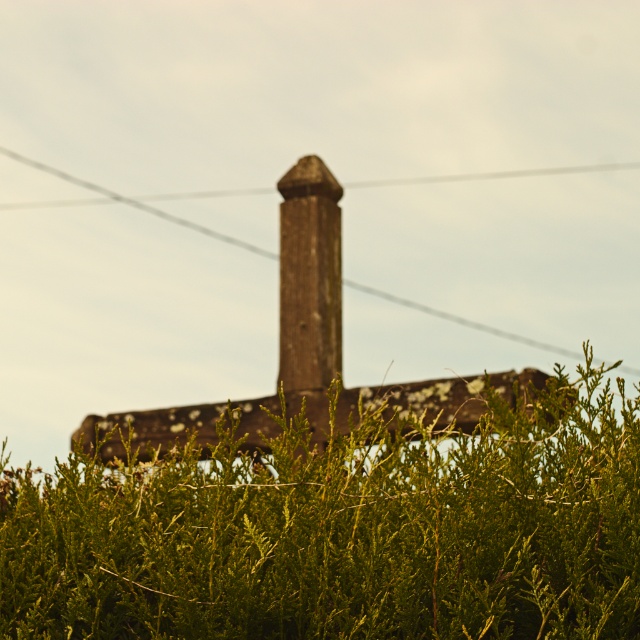
Question: Which object is closer to the camera taking this photo?

Choices:
 (A) green leafy hedge at center
 (B) brown stone pillar at center

Answer: (A)

Question: Is green leafy hedge at center thinner than brown stone pillar at center?

Choices:
 (A) no
 (B) yes

Answer: (A)

Question: Does green leafy hedge at center lie behind brown stone pillar at center?

Choices:
 (A) no
 (B) yes

Answer: (A)

Question: Is green leafy hedge at center wider than brown stone pillar at center?

Choices:
 (A) yes
 (B) no

Answer: (A)